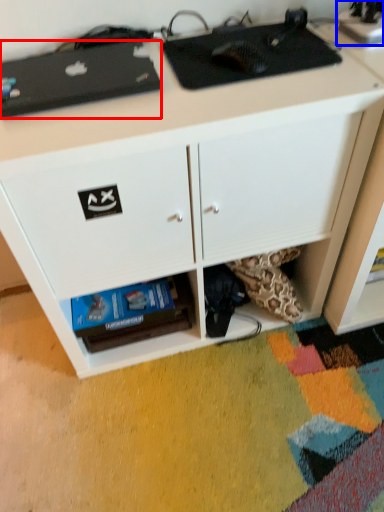
Question: Which point is closer to the camera, appliance (highlighted by a red box) or appliance (highlighted by a blue box)?

Choices:
 (A) appliance
 (B) appliance

Answer: (A)